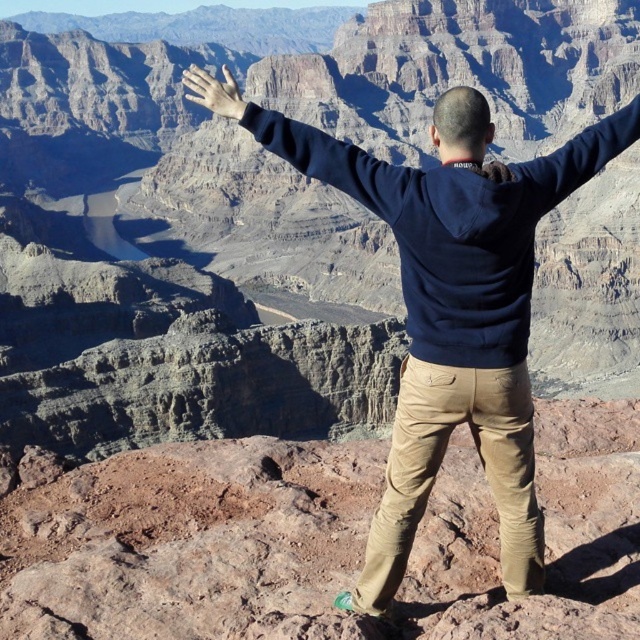
Looking at this image, does dark blue sweatshirt at center appear over black matte arm at upper center?

Actually, dark blue sweatshirt at center is below black matte arm at upper center.

Is dark blue sweatshirt at center bigger than black matte arm at upper center?

Actually, dark blue sweatshirt at center might be smaller than black matte arm at upper center.

In the scene shown: Measure the distance between dark blue sweatshirt at center and camera.

They are 27.02 meters apart.

Locate an element on the screen. dark blue sweatshirt at center is located at coordinates (456, 310).

Which is in front, point (364, 192) or point (192, 90)?

Point (364, 192) is in front.

Who is positioned more to the right, black matte arm at upper center or matte skin hand at upper center?

black matte arm at upper center

Between point (234, 92) and point (189, 100), which one is positioned in front?

Point (234, 92) is more forward.

Where is `black matte arm at upper center`? The height and width of the screenshot is (640, 640). black matte arm at upper center is located at coordinates (308, 147).

Does dark blue sweatshirt at center appear on the right side of matte skin hand at upper center?

Correct, you'll find dark blue sweatshirt at center to the right of matte skin hand at upper center.

Locate an element on the screen. The image size is (640, 640). dark blue sweatshirt at center is located at coordinates (456, 310).

Which is behind, point (451, 339) or point (195, 81)?

Positioned behind is point (195, 81).

Where is `dark blue sweatshirt at center`? dark blue sweatshirt at center is located at coordinates (456, 310).